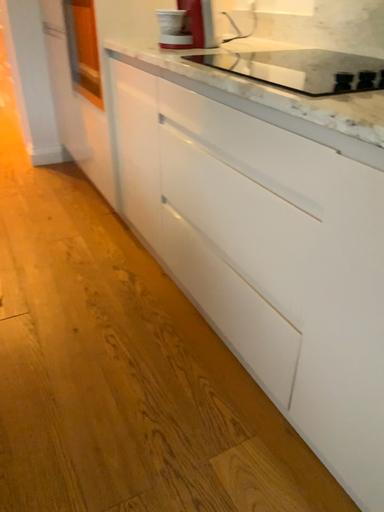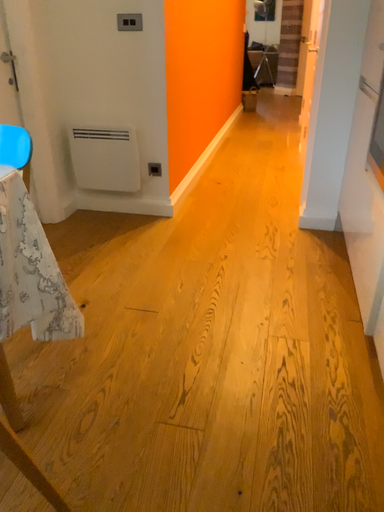
Question: How did the camera likely rotate when shooting the video?

Choices:
 (A) rotated right
 (B) rotated left

Answer: (B)